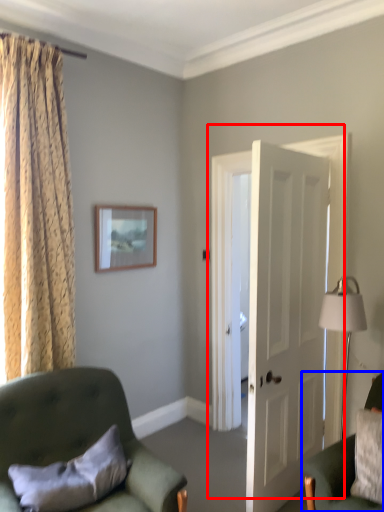
Question: Which object is closer to the camera taking this photo, door (highlighted by a red box) or chair (highlighted by a blue box)?

Choices:
 (A) door
 (B) chair

Answer: (B)